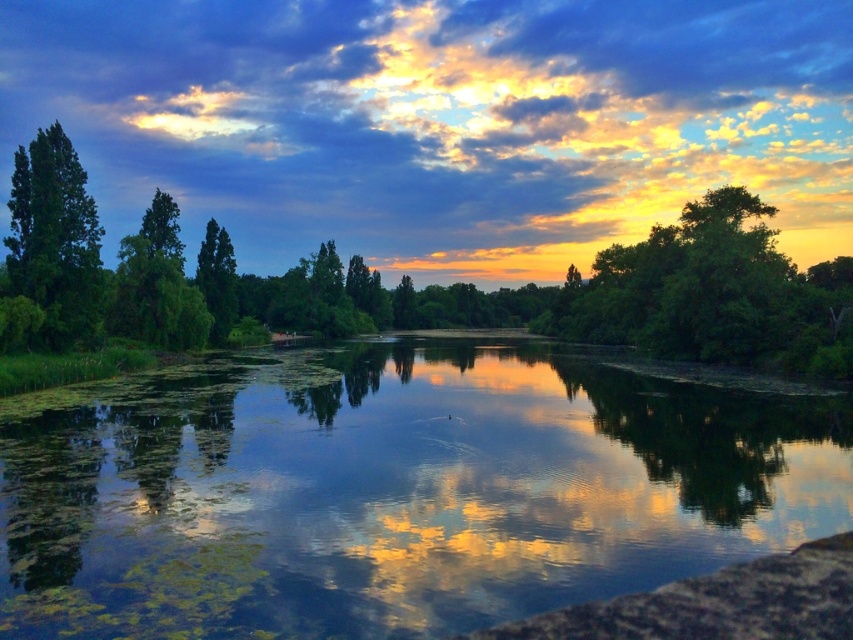
You are standing at the edge of the lake and want to take a photo of the green leafy tree at center. Which direction should you face to capture it in your camera view?

The green leafy tree at center is located at coordinates approximately 0.463 on the x and 0.686 on the y axis, so you should face towards the center of the lake to capture it in your photo.

You are standing at the lakeside and want to take a photo of the green leafy tree at center. If your camera has a maximum zoom range of 100 feet, will you be able to capture the tree clearly without moving closer?

The green leafy tree at center is 149.86 feet away from the camera, which exceeds the camera maximum zoom range of 100 feet. Therefore, you will not be able to capture the tree clearly without moving closer.